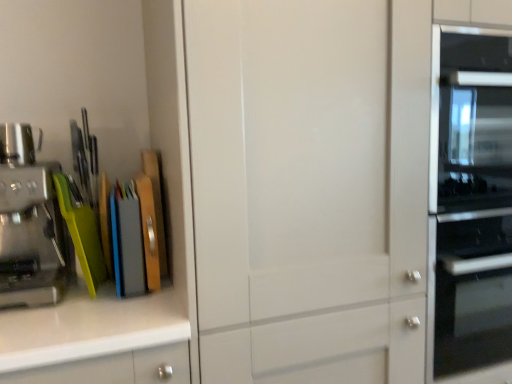
Question: Is the depth of brushed metal coffee machine at left greater than that of brushed metal coffee maker at left?

Choices:
 (A) yes
 (B) no

Answer: (B)

Question: Is brushed metal coffee machine at left thinner than brushed metal coffee maker at left?

Choices:
 (A) no
 (B) yes

Answer: (A)

Question: Is brushed metal coffee machine at left positioned before brushed metal coffee maker at left?

Choices:
 (A) no
 (B) yes

Answer: (B)

Question: Is brushed metal coffee machine at left surrounding brushed metal coffee maker at left?

Choices:
 (A) no
 (B) yes

Answer: (A)

Question: From the image's perspective, is brushed metal coffee machine at left under brushed metal coffee maker at left?

Choices:
 (A) no
 (B) yes

Answer: (B)

Question: Looking at the image, does transparent glass cabinet at center seem bigger or smaller compared to brushed metal coffee maker at left?

Choices:
 (A) big
 (B) small

Answer: (A)

Question: Considering the positions of transparent glass cabinet at center and brushed metal coffee maker at left in the image, is transparent glass cabinet at center taller or shorter than brushed metal coffee maker at left?

Choices:
 (A) short
 (B) tall

Answer: (B)

Question: Is point (257, 203) positioned closer to the camera than point (23, 152)?

Choices:
 (A) farther
 (B) closer

Answer: (B)

Question: Which is correct: transparent glass cabinet at center is inside brushed metal coffee maker at left, or outside of it?

Choices:
 (A) outside
 (B) inside

Answer: (A)

Question: From the image's perspective, is brushed metal coffee maker at left above or below transparent glass cabinet at center?

Choices:
 (A) below
 (B) above

Answer: (B)

Question: In terms of height, does brushed metal coffee maker at left look taller or shorter compared to transparent glass cabinet at center?

Choices:
 (A) tall
 (B) short

Answer: (B)

Question: From a real-world perspective, is brushed metal coffee maker at left positioned above or below transparent glass cabinet at center?

Choices:
 (A) above
 (B) below

Answer: (A)

Question: Is brushed metal coffee maker at left inside the boundaries of transparent glass cabinet at center, or outside?

Choices:
 (A) inside
 (B) outside

Answer: (B)

Question: Relative to brushed metal coffee machine at left, is transparent glass cabinet at center in front or behind?

Choices:
 (A) behind
 (B) front

Answer: (B)

Question: From the image's perspective, relative to brushed metal coffee machine at left, is transparent glass cabinet at center above or below?

Choices:
 (A) above
 (B) below

Answer: (B)